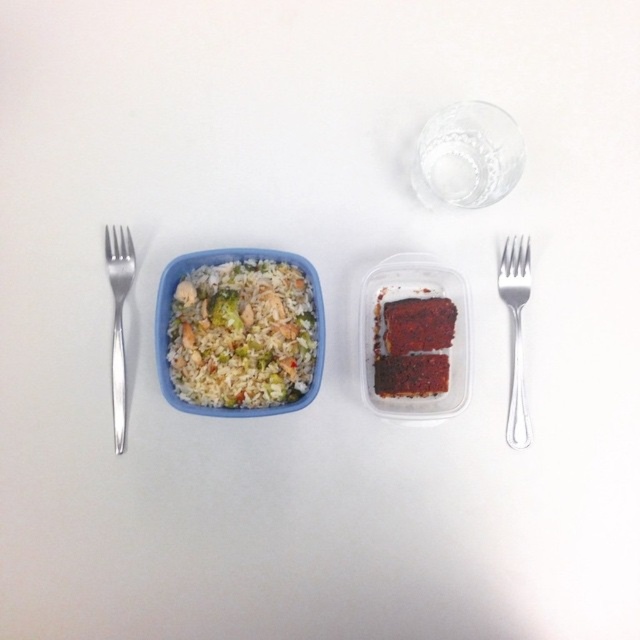
Is dark brown cake at center shorter than silver metallic fork at left?

Yes, dark brown cake at center is shorter than silver metallic fork at left.

Between point (432, 324) and point (115, 241), which one is positioned behind?

Positioned behind is point (115, 241).

Between point (413, 388) and point (131, 257), which one is positioned behind?

Point (131, 257)

Image resolution: width=640 pixels, height=640 pixels. I want to click on dark brown cake at center, so click(412, 346).

Can you confirm if silver metallic fork at left is bigger than green matte broccoli at center-left?

Indeed, silver metallic fork at left has a larger size compared to green matte broccoli at center-left.

Is point (113, 296) positioned behind point (237, 321)?

Yes, it is behind point (237, 321).

The width and height of the screenshot is (640, 640). I want to click on silver metallic fork at left, so [118, 321].

Which is above, white matte rice at center or dark brown cake at center?

white matte rice at center is higher up.

Is white matte rice at center smaller than dark brown cake at center?

Actually, white matte rice at center might be larger than dark brown cake at center.

Who is more forward, [177,328] or [387,394]?

Point [177,328] is in front.

The height and width of the screenshot is (640, 640). What are the coordinates of `white matte rice at center` in the screenshot? It's located at 244,336.